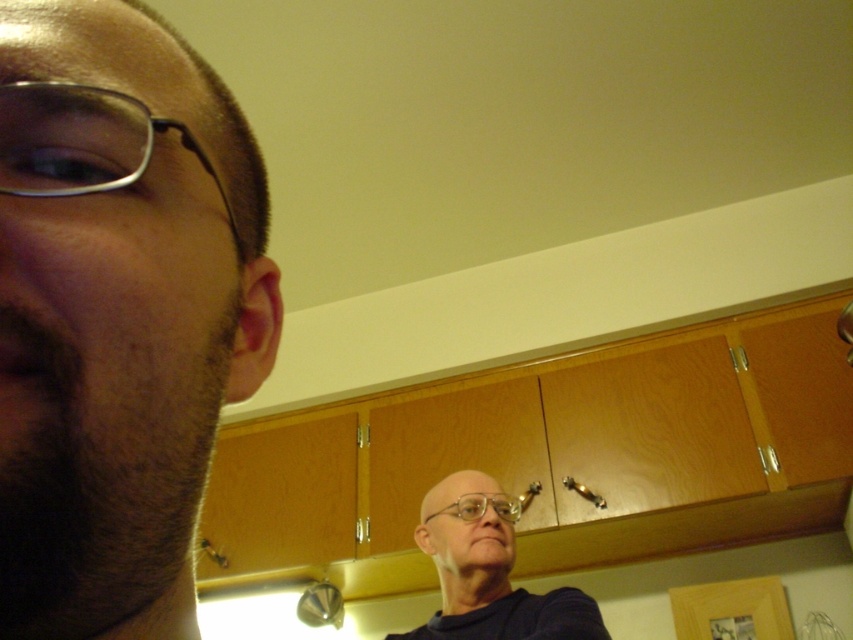
Which is behind, point (113, 500) or point (563, 614)?

Point (563, 614)

Can you confirm if beige matte skin at upper left is taller than bald head at upper center?

No.

Between point (70, 531) and point (461, 552), which one is positioned in front?

Point (70, 531) is in front.

Find the location of a particular element. This screenshot has width=853, height=640. beige matte skin at upper left is located at coordinates (117, 314).

Which is above, bald head at upper center or metallic frame glasses at left?

metallic frame glasses at left

Which is more to the left, bald head at upper center or metallic frame glasses at left?

Positioned to the left is metallic frame glasses at left.

Where is `bald head at upper center`? This screenshot has height=640, width=853. bald head at upper center is located at coordinates (488, 570).

Does metallic frame glasses at left have a smaller size compared to transparent plastic glasses at center?

Yes, metallic frame glasses at left is smaller than transparent plastic glasses at center.

Between metallic frame glasses at left and transparent plastic glasses at center, which one has more height?

With more height is transparent plastic glasses at center.

Which is in front, point (233, 224) or point (479, 496)?

Point (233, 224)

Image resolution: width=853 pixels, height=640 pixels. I want to click on metallic frame glasses at left, so pos(82,141).